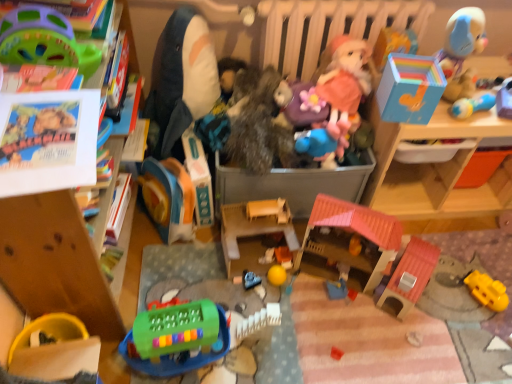
Find the location of a particular element. Image resolution: width=512 pixels, height=384 pixels. vacant area on the back side of yellow rubber ball at center, acting as the eighth toy starting from the right is located at coordinates click(276, 251).